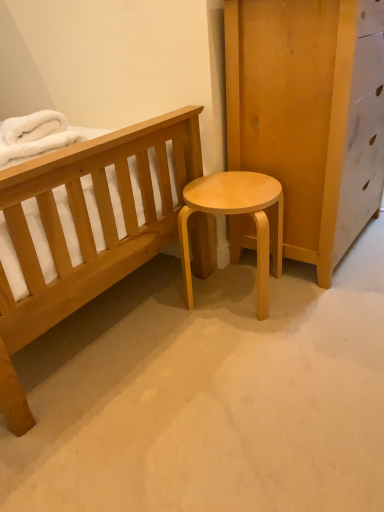
Question: Does white fluffy blanket at upper left have a greater width compared to light wood/matte stool at center?

Choices:
 (A) no
 (B) yes

Answer: (A)

Question: Does white fluffy blanket at upper left have a greater height compared to light wood/matte stool at center?

Choices:
 (A) no
 (B) yes

Answer: (A)

Question: Is white fluffy blanket at upper left behind light wood/matte stool at center?

Choices:
 (A) yes
 (B) no

Answer: (B)

Question: Is white fluffy blanket at upper left positioned far away from light wood/matte stool at center?

Choices:
 (A) no
 (B) yes

Answer: (A)

Question: Is white fluffy blanket at upper left next to light wood/matte stool at center?

Choices:
 (A) yes
 (B) no

Answer: (B)

Question: Considering the relative sizes of white fluffy blanket at upper left and light wood/matte stool at center in the image provided, is white fluffy blanket at upper left smaller than light wood/matte stool at center?

Choices:
 (A) yes
 (B) no

Answer: (A)

Question: From the image's perspective, would you say light wood/matte stool at center is positioned over white fluffy blanket at upper left?

Choices:
 (A) no
 (B) yes

Answer: (A)

Question: Would you say white fluffy blanket at upper left is part of light wood/matte stool at center's contents?

Choices:
 (A) no
 (B) yes

Answer: (A)

Question: Is light wood/matte stool at center at the left side of white fluffy blanket at upper left?

Choices:
 (A) yes
 (B) no

Answer: (B)

Question: Is light wood/matte stool at center thinner than white fluffy blanket at upper left?

Choices:
 (A) yes
 (B) no

Answer: (B)

Question: Is light wood/matte stool at center not within white fluffy blanket at upper left?

Choices:
 (A) no
 (B) yes

Answer: (B)

Question: Considering the relative sizes of light wood/matte stool at center and white fluffy blanket at upper left in the image provided, is light wood/matte stool at center shorter than white fluffy blanket at upper left?

Choices:
 (A) no
 (B) yes

Answer: (A)

Question: Based on their sizes in the image, would you say light wood/matte stool at center is bigger or smaller than white fluffy blanket at upper left?

Choices:
 (A) small
 (B) big

Answer: (B)